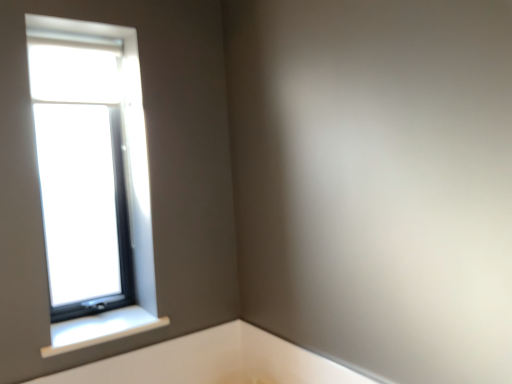
Locate an element on the screen. vacant space situated above white plastic window sill at lower left (from a real-world perspective) is located at coordinates (110, 321).